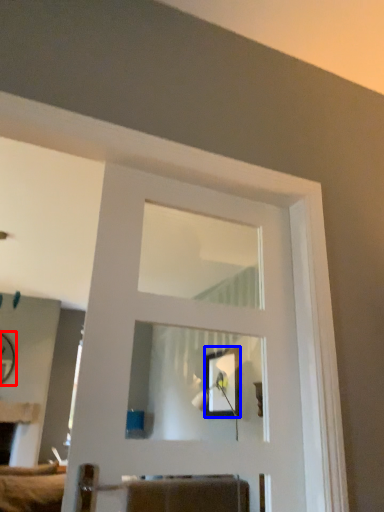
Question: Which of the following is the farthest to the observer, mirror (highlighted by a red box) or picture frame (highlighted by a blue box)?

Choices:
 (A) mirror
 (B) picture frame

Answer: (A)